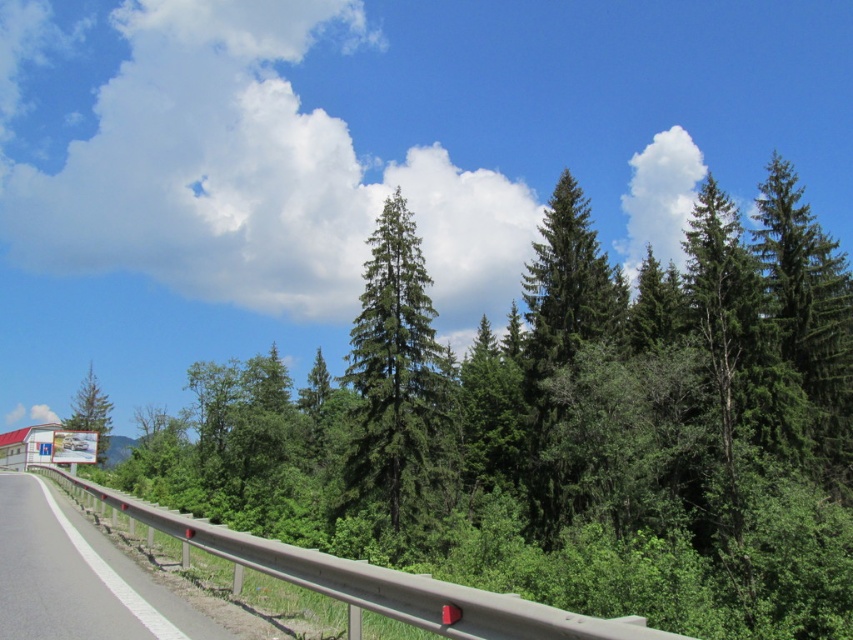
Question: Which point is farther to the camera?

Choices:
 (A) (97, 436)
 (B) (399, 420)

Answer: (A)

Question: Can you confirm if green matte tree at center is wider than metallic gray guardrail at lower left?

Choices:
 (A) yes
 (B) no

Answer: (B)

Question: Is green matte tree at center closer to camera compared to metallic gray guardrail at lower left?

Choices:
 (A) no
 (B) yes

Answer: (A)

Question: Which point is farther to the camera?

Choices:
 (A) (106, 422)
 (B) (85, 632)
 (C) (409, 332)

Answer: (A)

Question: Among these points, which one is nearest to the camera?

Choices:
 (A) (7, 566)
 (B) (387, 240)
 (C) (109, 424)

Answer: (A)

Question: Is green matte tree at center above metallic gray guardrail at lower left?

Choices:
 (A) yes
 (B) no

Answer: (A)